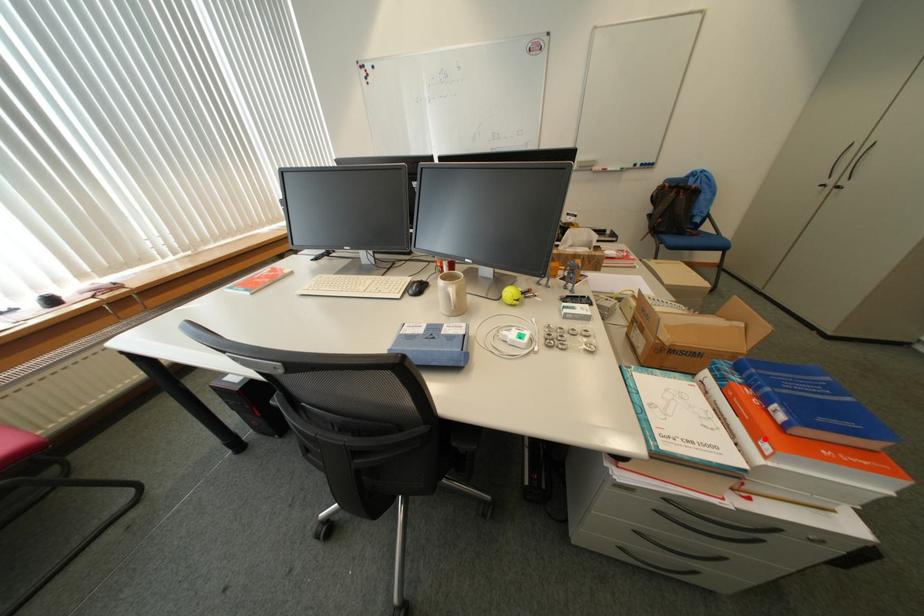
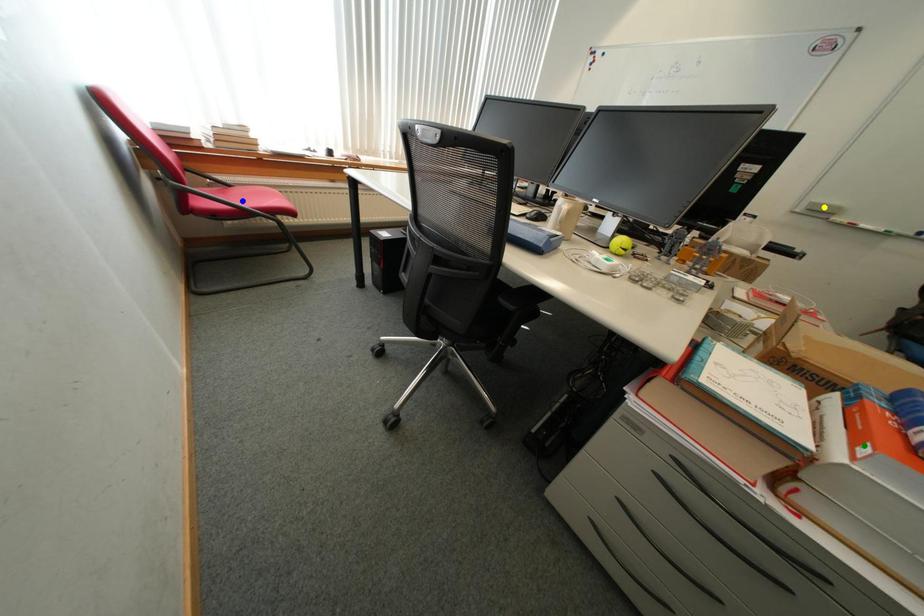
Question: I am providing you with two images of the same scene from different viewpoints. A red point is marked on the first image. You are given multiple points on the second image. Which spot in image 2 lines up with the point in image 1?

Choices:
 (A) yellow point
 (B) blue point
 (C) green point

Answer: (C)